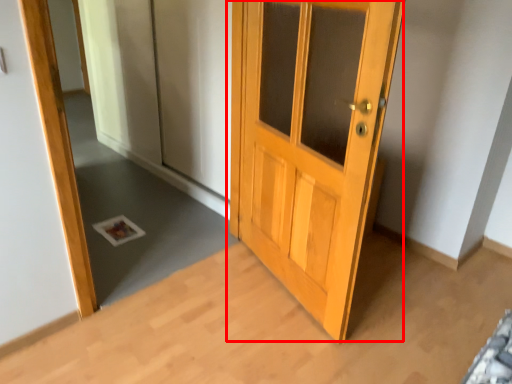
Question: From the image's perspective, where is door (annotated by the red box) located in relation to mirror in the image?

Choices:
 (A) below
 (B) above

Answer: (A)